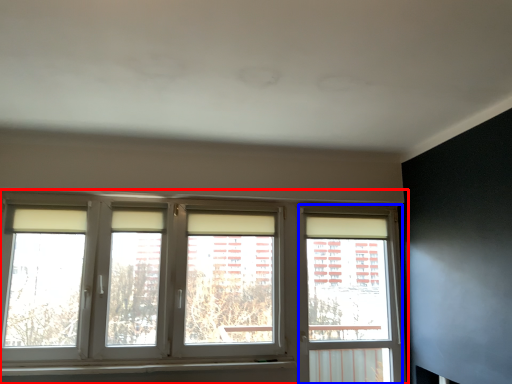
Question: Which of the following is the farthest to the observer, window (highlighted by a red box) or window frame (highlighted by a blue box)?

Choices:
 (A) window
 (B) window frame

Answer: (B)